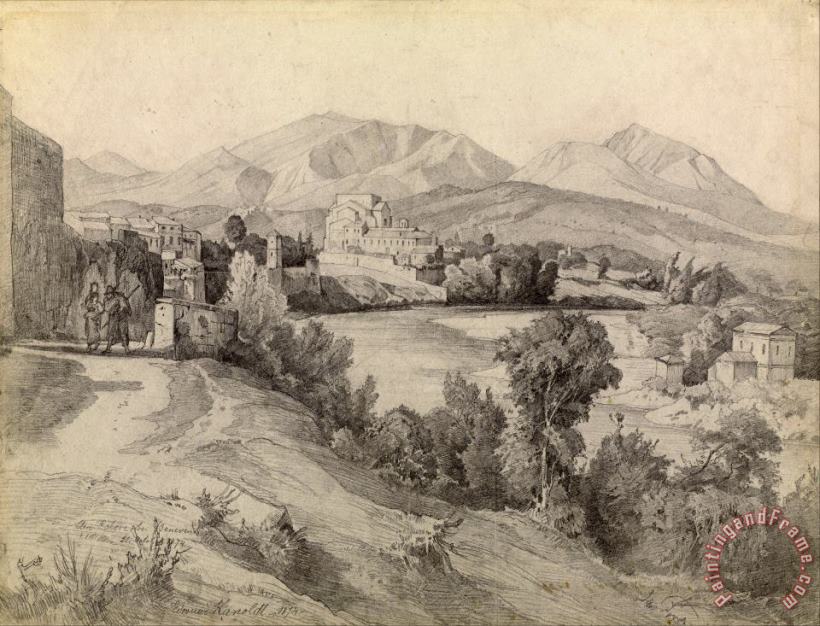
Identify the location of canvas. 512,22.